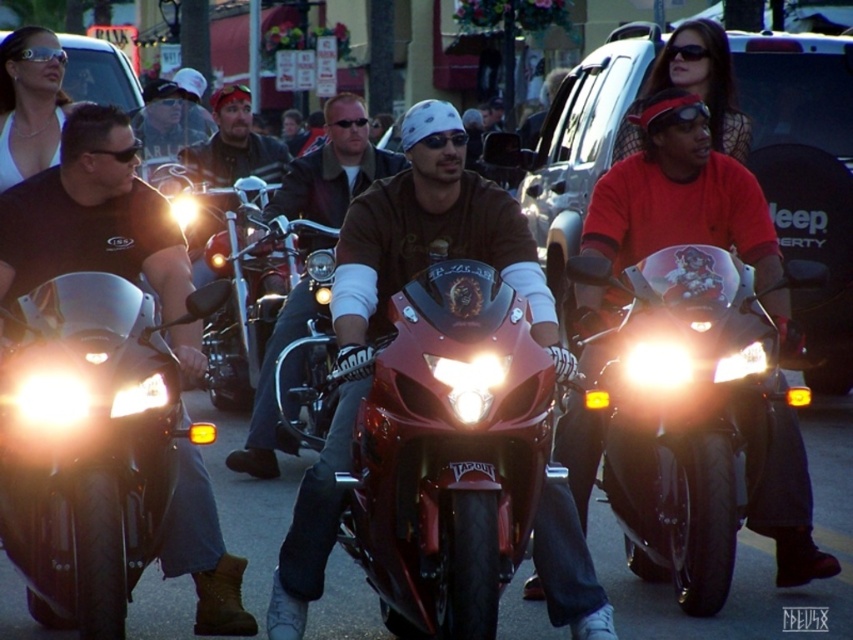
Question: Is shiny red motorcycle at center above glossy black motorcycle at center?

Choices:
 (A) yes
 (B) no

Answer: (B)

Question: Is the position of matte brown leather jacket at center more distant than that of glossy red motorcycle at center?

Choices:
 (A) no
 (B) yes

Answer: (A)

Question: Among these points, which one is nearest to the camera?

Choices:
 (A) (613, 435)
 (B) (347, 173)
 (C) (386, 616)
 (D) (122, 541)

Answer: (D)

Question: Which of the following is the closest to the observer?

Choices:
 (A) glossy red motorcycle at center
 (B) shiny red motorcycle at center
 (C) matte brown leather jacket at center
 (D) shiny chrome motorcycle at left

Answer: (B)

Question: Is shiny chrome motorcycle at left smaller than glossy black motorcycle at center?

Choices:
 (A) no
 (B) yes

Answer: (B)

Question: Which object is the closest to the shiny chrome motorcycle at left?

Choices:
 (A) glossy black motorcycle at center
 (B) matte black motorcycle at center
 (C) matte brown leather jacket at center
 (D) shiny red motorcycle at center

Answer: (D)